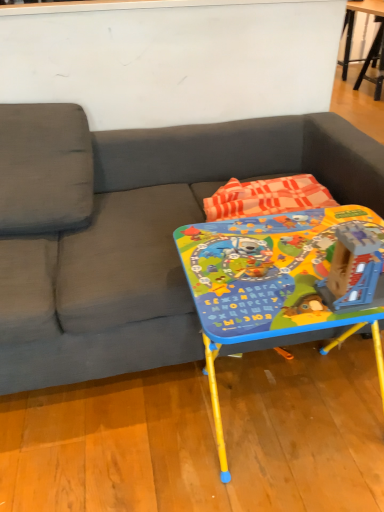
Image resolution: width=384 pixels, height=512 pixels. I want to click on free spot to the left of matte plastic table at center, arranged as the first table when ordered from the bottom, so click(x=123, y=436).